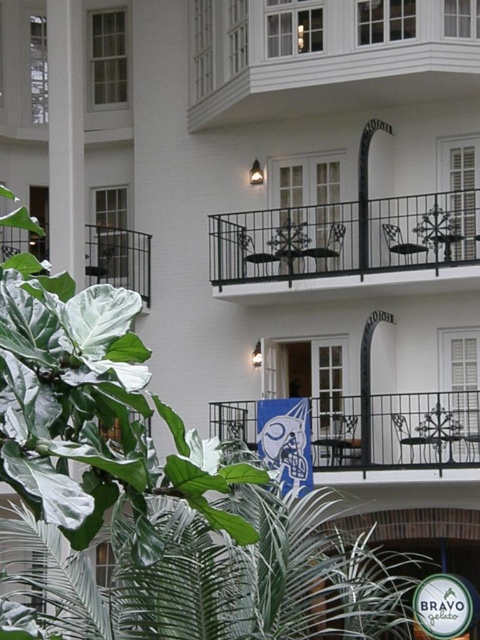
Which is more to the right, metallic wrought iron balcony at center or black wrought iron balcony at left?

metallic wrought iron balcony at center is more to the right.

Can you confirm if metallic wrought iron balcony at center is positioned to the left of black wrought iron balcony at left?

In fact, metallic wrought iron balcony at center is to the right of black wrought iron balcony at left.

Where is `metallic wrought iron balcony at center`? This screenshot has width=480, height=640. metallic wrought iron balcony at center is located at coordinates (396, 429).

Who is positioned more to the right, white painted wood balcony at upper center or black wrought iron balcony at left?

Positioned to the right is white painted wood balcony at upper center.

This screenshot has width=480, height=640. What are the coordinates of `white painted wood balcony at upper center` in the screenshot? It's located at (325, 56).

At what (x,y) coordinates should I click in order to perform the action: click on white painted wood balcony at upper center. Please return your answer as a coordinate pair (x, y). The width and height of the screenshot is (480, 640). Looking at the image, I should click on (325, 56).

Does white painted wood balcony at upper center appear over white smooth pillar at upper left?

Indeed, white painted wood balcony at upper center is positioned over white smooth pillar at upper left.

Can you confirm if white painted wood balcony at upper center is wider than white smooth pillar at upper left?

Indeed, white painted wood balcony at upper center has a greater width compared to white smooth pillar at upper left.

Looking at this image, who is more forward, (x=195, y=96) or (x=50, y=61)?

Point (x=50, y=61)

Where is `white painted wood balcony at upper center`? The image size is (480, 640). white painted wood balcony at upper center is located at coordinates coord(325,56).